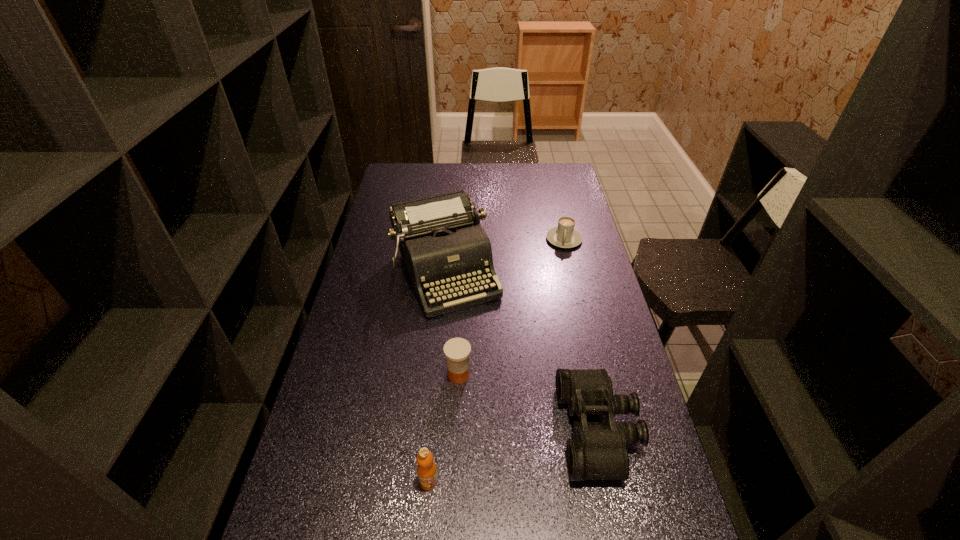
The height and width of the screenshot is (540, 960). In order to click on free space on the desktop that is between the orange juice and the binoculars and is positioned to the right of the shortest object in this screenshot , I will do `click(536, 449)`.

Locate an element on the screen. vacant space on the desktop that is between the orange juice and the binoculars and is positioned on the front-facing side of the typewriter is located at coordinates (534, 449).

Where is `free space on the desktop that is between the orange juice and the binoculars and is positioned on the label of the medicine`? Image resolution: width=960 pixels, height=540 pixels. free space on the desktop that is between the orange juice and the binoculars and is positioned on the label of the medicine is located at coordinates (534, 449).